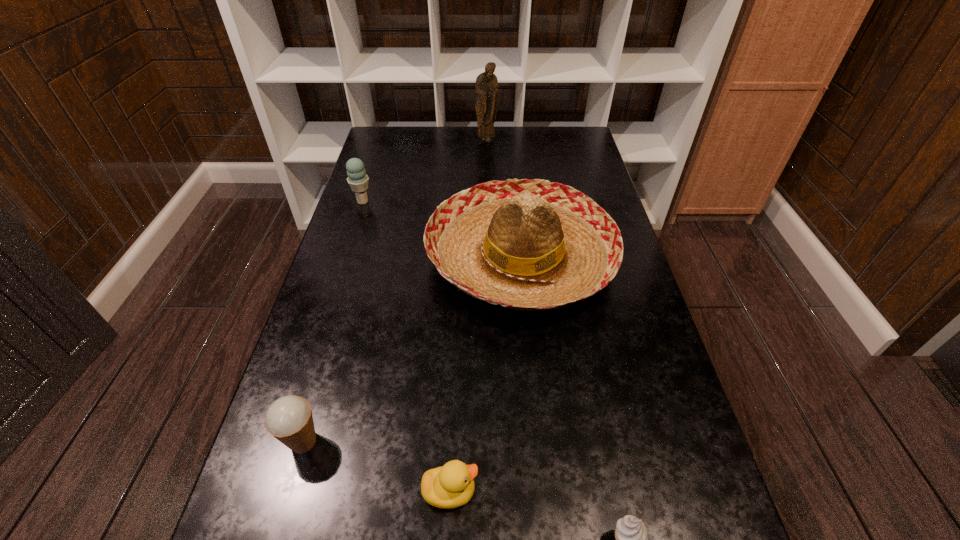
Locate an element on the screen. This screenshot has height=540, width=960. the farthest object is located at coordinates (486, 87).

I want to click on the tallest object, so click(486, 87).

Identify the location of sombrero. This screenshot has width=960, height=540. (533, 245).

Locate an element on the screen. This screenshot has width=960, height=540. the farthest icecream is located at coordinates 358,180.

Locate an element on the screen. Image resolution: width=960 pixels, height=540 pixels. the fourth farthest object is located at coordinates (289, 419).

Image resolution: width=960 pixels, height=540 pixels. Identify the location of the fifth farthest object. (450, 486).

You are a GUI agent. You are given a task and a screenshot of the screen. Output one action in this format:
    pyautogui.click(x=<x>, y=<y>)
    Task: Click on the shortest object
    The height and width of the screenshot is (540, 960).
    Given the screenshot: What is the action you would take?
    [x=450, y=486]

Image resolution: width=960 pixels, height=540 pixels. What are the coordinates of `vacant space located 0.130m on the front-facing side of the farthest object` in the screenshot? It's located at (487, 162).

Where is `blank area located 0.290m on the back of the sombrero`? This screenshot has height=540, width=960. blank area located 0.290m on the back of the sombrero is located at coordinates (511, 156).

At what (x,y) coordinates should I click in order to perform the action: click on vacant point located on the back of the farthest icecream. Please return your answer as a coordinate pair (x, y). This screenshot has height=540, width=960. Looking at the image, I should click on (373, 167).